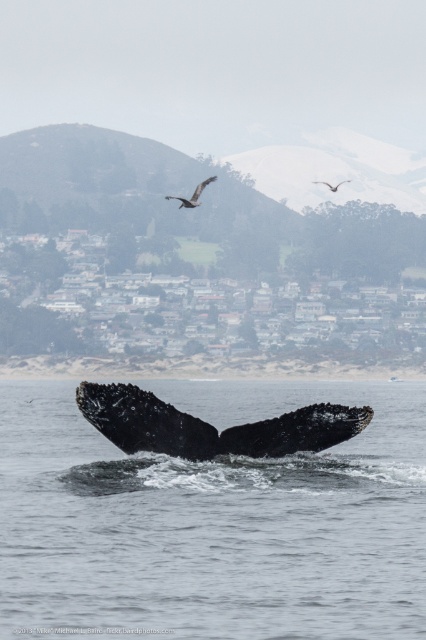
You are a photographer positioned at the origin of the coordinate system. You want to capture both the point at point (319, 426) and point (317, 180) in your shot. Which point should you focus on first to ensure both are in frame?

Point (319, 426) is in front of point (317, 180), so you should focus on point (319, 426) first to ensure both are in frame.

You are a birdwatcher observing the dark brown feathered bird at upper center and the brown feathered eagle at upper center in the coastal town scene. Which bird has a wider wingspan?

The dark brown feathered bird at upper center has a wider wingspan than the brown feathered eagle at upper center because its width is larger.